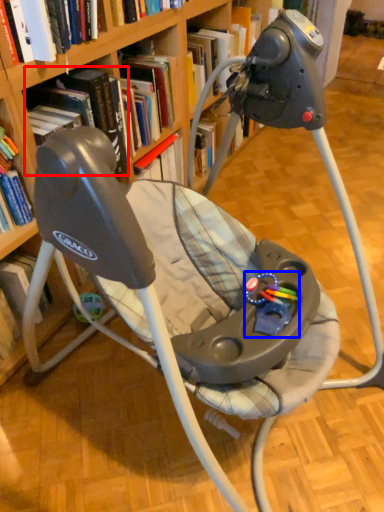
Question: Which point is closer to the camera, book (highlighted by a red box) or toy (highlighted by a blue box)?

Choices:
 (A) book
 (B) toy

Answer: (B)